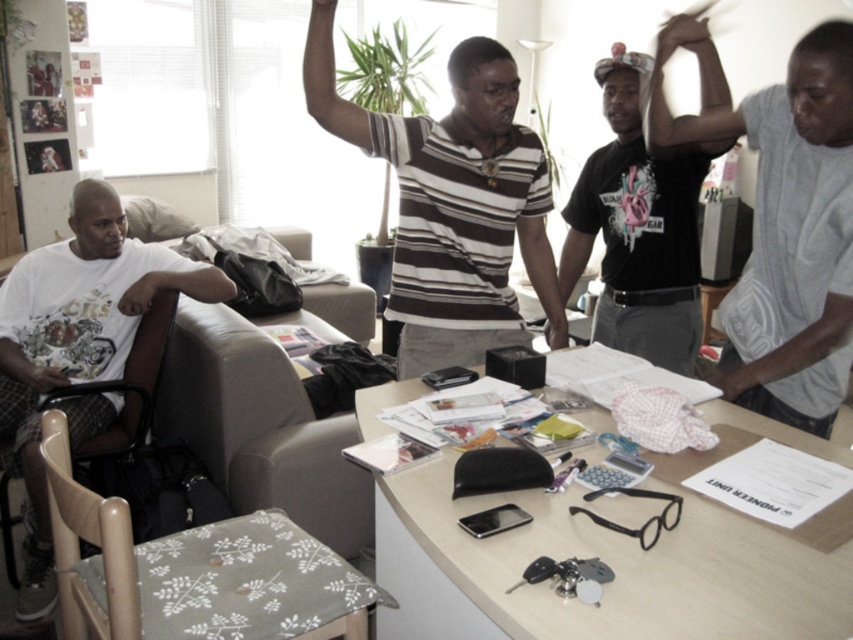
Question: Does striped cotton shirt at center appear on the right side of white cotton t-shirt at left?

Choices:
 (A) yes
 (B) no

Answer: (A)

Question: Which object appears farthest from the camera in this image?

Choices:
 (A) matte black hand at upper right
 (B) gray cotton shirt at right
 (C) striped cotton shirt at center

Answer: (C)

Question: Based on their relative distances, which object is nearer to the light beige laminate table at center?

Choices:
 (A) gray fabric armchair at lower left
 (B) white cotton t-shirt at left

Answer: (A)

Question: Which point is closer to the camera taking this photo?

Choices:
 (A) (659, 52)
 (B) (627, 164)
 (C) (62, 332)

Answer: (A)

Question: Does light beige laminate table at center appear on the right side of matte black hand at upper right?

Choices:
 (A) no
 (B) yes

Answer: (A)

Question: Does beige fabric armchair at center have a lesser width compared to matte black hand at upper right?

Choices:
 (A) no
 (B) yes

Answer: (A)